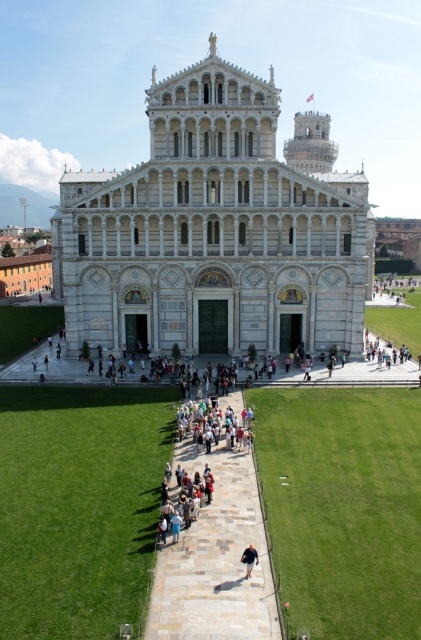
Who is positioned more to the left, multicolored fabric crowd at center or light brown leather shoes at center?

From the viewer's perspective, light brown leather shoes at center appears more on the left side.

Describe the element at coordinates (213, 424) in the screenshot. The height and width of the screenshot is (640, 421). I see `multicolored fabric crowd at center` at that location.

Identify the location of multicolored fabric crowd at center. The height and width of the screenshot is (640, 421). (213, 424).

Is white marble palace at center to the right of light brown leather shoes at center from the viewer's perspective?

Indeed, white marble palace at center is positioned on the right side of light brown leather shoes at center.

Describe the element at coordinates (216, 228) in the screenshot. I see `white marble palace at center` at that location.

Does point (314, 282) come closer to viewer compared to point (181, 499)?

No, it is not.

Where is `white marble palace at center`? The image size is (421, 640). white marble palace at center is located at coordinates (216, 228).

This screenshot has height=640, width=421. I want to click on white marble palace at center, so click(216, 228).

Does white marble palace at center appear under light blue denim jeans at lower center?

Incorrect, white marble palace at center is not positioned below light blue denim jeans at lower center.

Is point (213, 81) positioned in front of point (247, 554)?

No, it is behind (247, 554).

The width and height of the screenshot is (421, 640). Find the location of `white marble palace at center`. white marble palace at center is located at coordinates (216, 228).